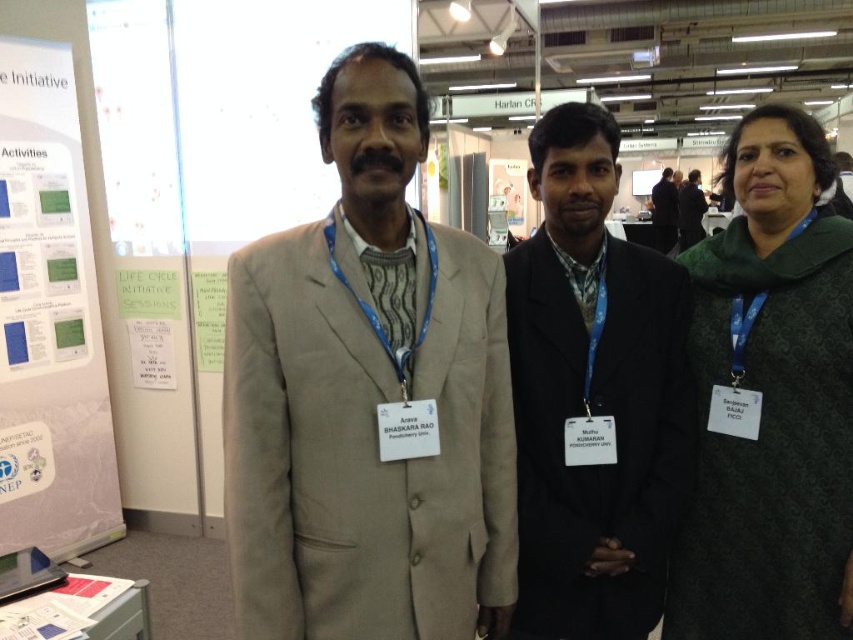
You are at a conference and need to find the person wearing the dark gray suit at center. Which direction should you look relative to the green textured shawl at right?

The dark gray suit at center is to the right of the green textured shawl at right, so you should look to the right side of the green textured shawl at right to find the person wearing the dark gray suit at center.